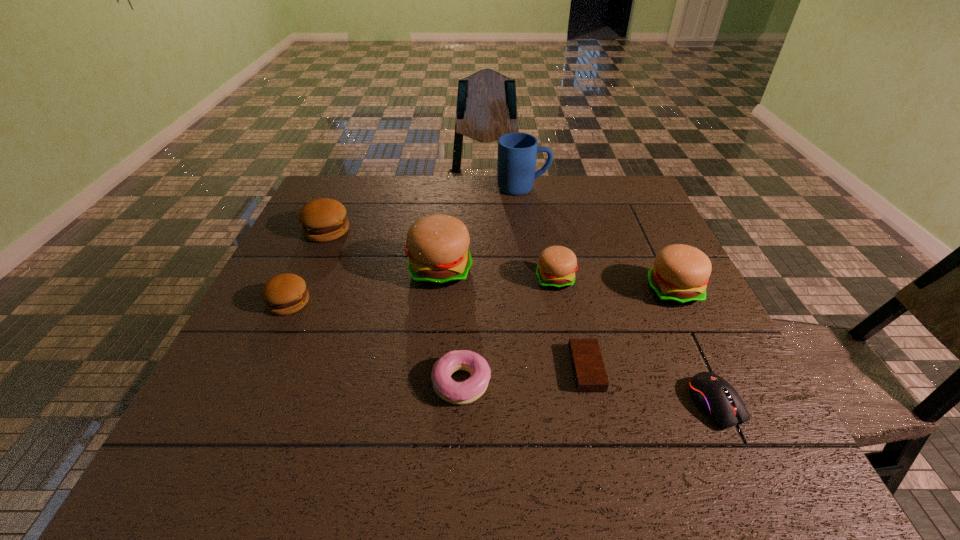
Where is `vacant area between the black alarm clock and the doughnut`? vacant area between the black alarm clock and the doughnut is located at coordinates pyautogui.click(x=524, y=376).

The width and height of the screenshot is (960, 540). What are the coordinates of `blank region between the smallest beige hamburger and the shortest hamburger` in the screenshot? It's located at (422, 291).

I want to click on free spot between the second smallest beige hamburger and the doughnut, so [x=567, y=337].

At what (x,y) coordinates should I click in order to perform the action: click on free space between the second tallest hamburger and the fourth hamburger from left to right. Please return your answer as a coordinate pair (x, y). Looking at the image, I should click on (614, 286).

Find the location of `free point between the alarm clock and the seventh shortest object`. free point between the alarm clock and the seventh shortest object is located at coordinates point(630,330).

Where is `free space between the farthest hamburger and the leftmost beige hamburger`? The width and height of the screenshot is (960, 540). free space between the farthest hamburger and the leftmost beige hamburger is located at coordinates (383, 251).

Locate an element on the screen. free space between the pink doughnut and the biggest beige hamburger is located at coordinates (451, 327).

Identify which object is the third closest to the second biggest beige hamburger. Please provide its 2D coordinates. Your answer should be formatted as a tuple, i.e. [(x, y)], where the tuple contains the x and y coordinates of a point satisfying the conditions above.

[(589, 373)]

Point out which object is positioned as the fourth nearest to the shortest object. Please provide its 2D coordinates. Your answer should be formatted as a tuple, i.e. [(x, y)], where the tuple contains the x and y coordinates of a point satisfying the conditions above.

[(680, 274)]

Image resolution: width=960 pixels, height=540 pixels. In order to click on the fifth closest hamburger to the shortest object in this screenshot , I will do click(x=324, y=219).